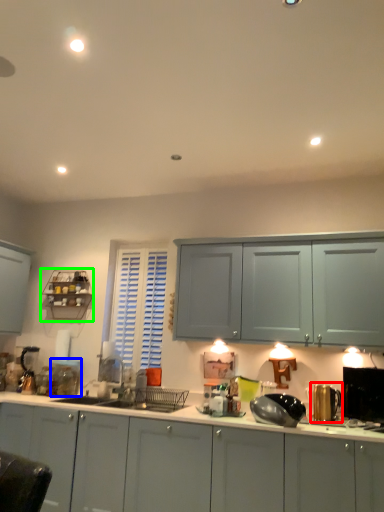
Question: Which object is positioned closest to appliance (highlighted by a red box)? Select from appliance (highlighted by a blue box) and shelf (highlighted by a green box).

Choices:
 (A) appliance
 (B) shelf

Answer: (A)